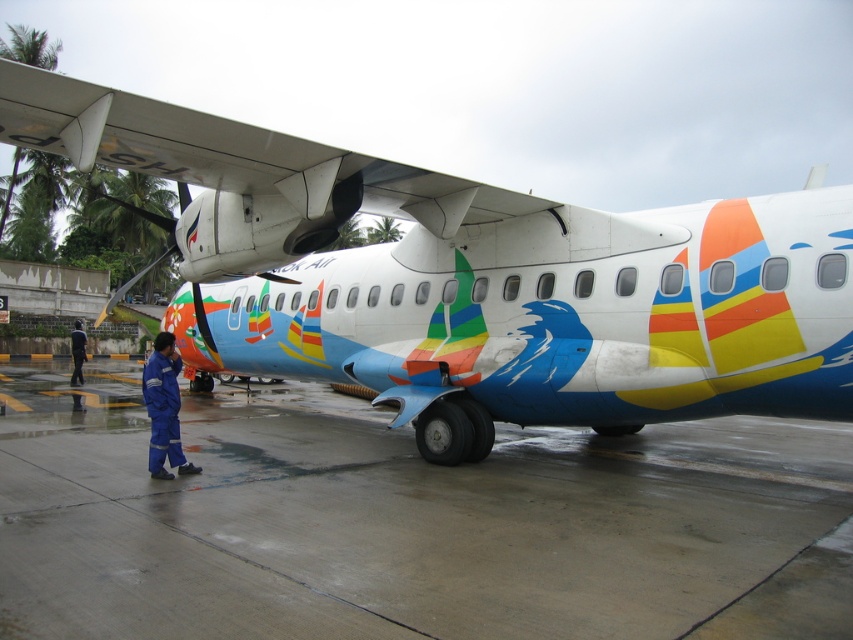
Which of these two, wet concrete tarmac at lower center or blue fabric uniform at center, stands shorter?

blue fabric uniform at center is shorter.

Who is taller, wet concrete tarmac at lower center or blue fabric uniform at center?

wet concrete tarmac at lower center

Does point (6, 392) lie in front of point (169, 337)?

No, (6, 392) is behind (169, 337).

You are a GUI agent. You are given a task and a screenshot of the screen. Output one action in this format:
    pyautogui.click(x=<x>, y=<y>)
    Task: Click on the wet concrete tarmac at lower center
    This screenshot has height=640, width=853.
    Given the screenshot: What is the action you would take?
    pyautogui.click(x=408, y=524)

Is matte white airplane at center closer to the viewer compared to blue fabric uniform at center?

Yes, it is in front of blue fabric uniform at center.

Between point (814, 253) and point (157, 355), which one is positioned in front?

Point (814, 253)

Between point (483, 205) and point (158, 368), which one is positioned in front?

Point (158, 368)

At what (x,y) coordinates should I click in order to perform the action: click on matte white airplane at center. Please return your answer as a coordinate pair (x, y). Looking at the image, I should click on (471, 280).

Between wet concrete tarmac at lower center and blue uniform at lower left, which one appears on the right side from the viewer's perspective?

From the viewer's perspective, wet concrete tarmac at lower center appears more on the right side.

Is point (567, 572) behind point (79, 378)?

No, it is in front of (79, 378).

At what (x,y) coordinates should I click in order to perform the action: click on wet concrete tarmac at lower center. Please return your answer as a coordinate pair (x, y). The width and height of the screenshot is (853, 640). Looking at the image, I should click on (408, 524).